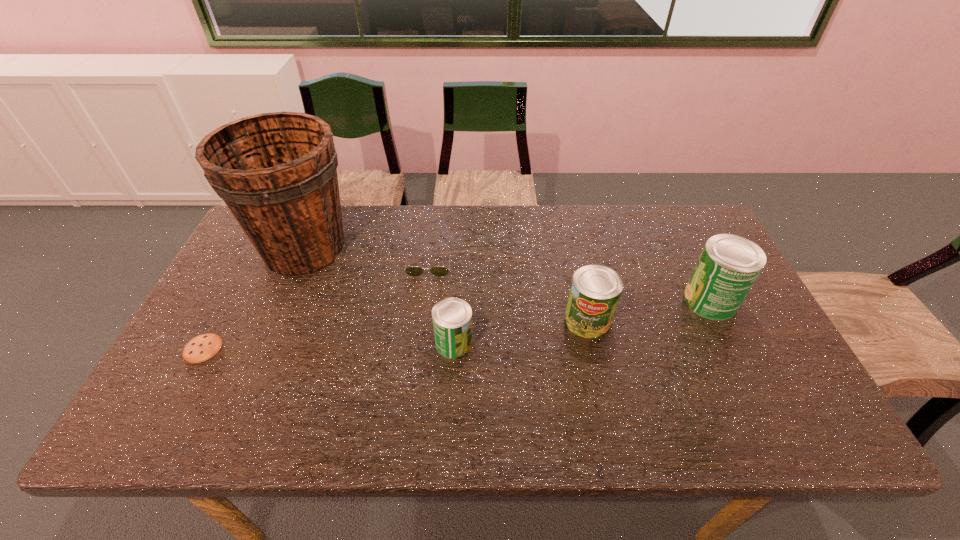
Locate an element on the screen. This screenshot has height=540, width=960. free space between the second tallest can and the leftmost can is located at coordinates coord(520,332).

The height and width of the screenshot is (540, 960). I want to click on blank region between the sunglasses and the second shortest can, so click(509, 292).

Locate an element on the screen. free spot between the tallest object and the fifth shortest object is located at coordinates (508, 274).

Where is `empty space that is in between the second shortest object and the fifth shortest object`? empty space that is in between the second shortest object and the fifth shortest object is located at coordinates (569, 281).

You are a GUI agent. You are given a task and a screenshot of the screen. Output one action in this format:
    pyautogui.click(x=<x>, y=<y>)
    Task: Click on the empty location between the second shortest object and the bucket
    The height and width of the screenshot is (540, 960).
    Given the screenshot: What is the action you would take?
    pyautogui.click(x=367, y=255)

The width and height of the screenshot is (960, 540). What are the coordinates of `free area in between the cookie and the leftmost can` in the screenshot? It's located at (328, 346).

Choose which object is the fourth nearest neighbor to the fifth shortest object. Please provide its 2D coordinates. Your answer should be formatted as a tuple, i.e. [(x, y)], where the tuple contains the x and y coordinates of a point satisfying the conditions above.

[(277, 172)]

You are a GUI agent. You are given a task and a screenshot of the screen. Output one action in this format:
    pyautogui.click(x=<x>, y=<y>)
    Task: Click on the object that is the third closest to the sunglasses
    The height and width of the screenshot is (540, 960).
    Given the screenshot: What is the action you would take?
    pyautogui.click(x=595, y=291)

Identify which can is the second closest to the tallest can. Please provide its 2D coordinates. Your answer should be formatted as a tuple, i.e. [(x, y)], where the tuple contains the x and y coordinates of a point satisfying the conditions above.

[(452, 317)]

Select which can appears as the second closest to the rightmost object. Please provide its 2D coordinates. Your answer should be formatted as a tuple, i.e. [(x, y)], where the tuple contains the x and y coordinates of a point satisfying the conditions above.

[(452, 317)]